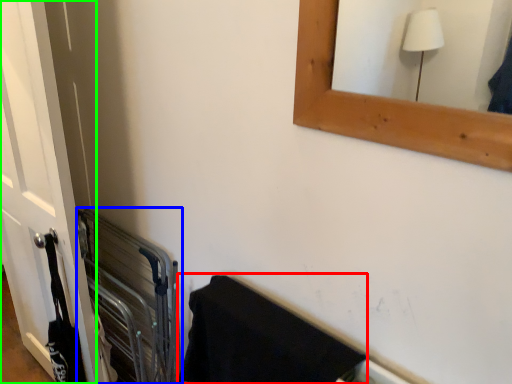
Question: Which is nearer to the bath towel (highlighted by a red box)? balustrade (highlighted by a blue box) or door (highlighted by a green box).

Choices:
 (A) balustrade
 (B) door

Answer: (A)